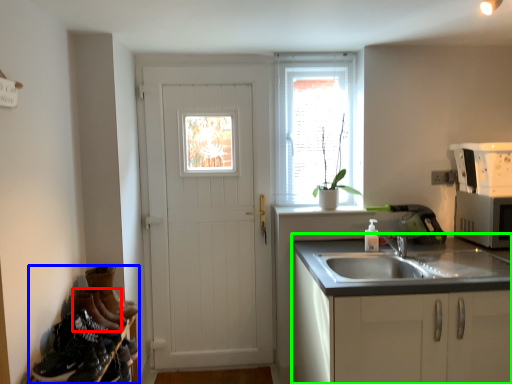
Question: Which object is the farthest from shoe (highlighted by a red box)? Choose among these: shelf (highlighted by a blue box) or cabinetry (highlighted by a green box).

Choices:
 (A) shelf
 (B) cabinetry

Answer: (B)